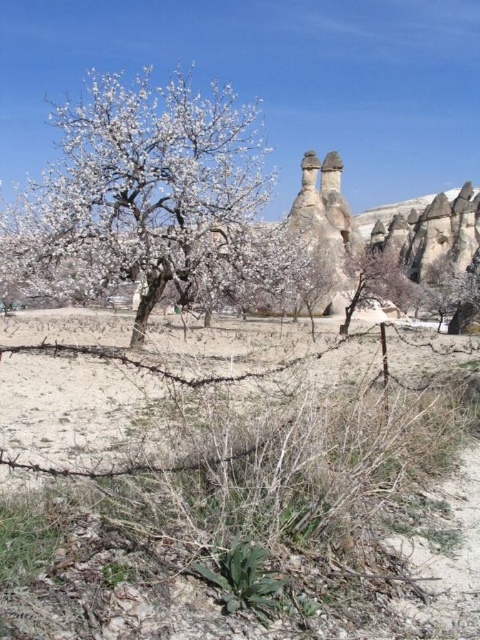
Question: Does white blossoming tree at center have a lesser width compared to brown sandy dirt field at center?

Choices:
 (A) no
 (B) yes

Answer: (B)

Question: Is white blossoming tree at center to the left of brown sandy dirt field at center from the viewer's perspective?

Choices:
 (A) yes
 (B) no

Answer: (A)

Question: Which object is farther from the camera taking this photo?

Choices:
 (A) brown sandy dirt field at center
 (B) white blossoming tree at center

Answer: (B)

Question: Is white blossoming tree at center positioned before brown sandy dirt field at center?

Choices:
 (A) yes
 (B) no

Answer: (B)